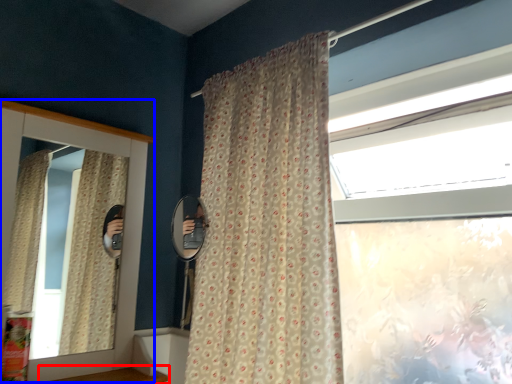
Question: Which object is further to the camera taking this photo, window sill (highlighted by a red box) or medicine cabinet (highlighted by a blue box)?

Choices:
 (A) window sill
 (B) medicine cabinet

Answer: (B)